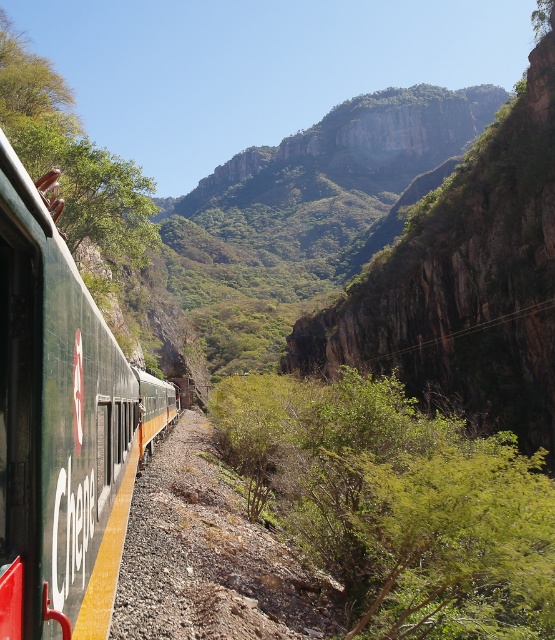
You are a passenger on the green matte train at left and want to take a photo of the green rocky cliff at upper center. Can you see the entire cliff in your viewfinder without moving your camera?

The green rocky cliff at upper center is further to the viewer than the green matte train at left, so the cliff is closer to you. This means the train is between you and the cliff, potentially blocking your view. Therefore, you cannot see the entire cliff without moving your camera.

You are a passenger on the train and looking out the window. You see a green rocky cliff at upper center. Where exactly is this cliff located in the image?

The green rocky cliff at upper center is located at point (466,280) in the image.